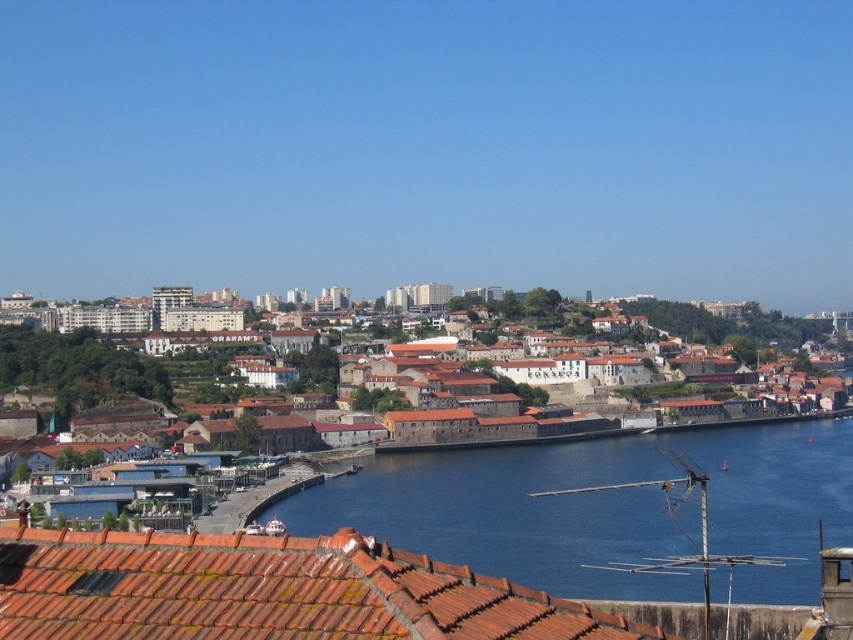
Question: Can you confirm if blue water at center is thinner than brown stone buildings at center?

Choices:
 (A) no
 (B) yes

Answer: (B)

Question: Does blue water at center appear under brown stone buildings at center?

Choices:
 (A) yes
 (B) no

Answer: (B)

Question: Which object is positioned farthest from the blue water at center?

Choices:
 (A) terracotta tiles at lower center
 (B) brown stone buildings at center

Answer: (A)

Question: Which point appears farthest from the camera in this image?

Choices:
 (A) (172, 582)
 (B) (612, 444)

Answer: (B)

Question: Which point is farther to the camera?

Choices:
 (A) brown stone buildings at center
 (B) terracotta tiles at lower center
 (C) blue water at center

Answer: (A)

Question: Is blue water at center bigger than brown stone buildings at center?

Choices:
 (A) yes
 (B) no

Answer: (A)